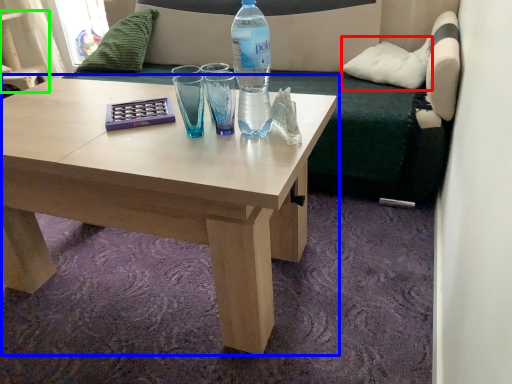
Question: Estimate the real-world distances between objects in this image. Which object is closer to pillow (highlighted by a red box), coffee table (highlighted by a blue box) or armchair (highlighted by a green box)?

Choices:
 (A) coffee table
 (B) armchair

Answer: (A)